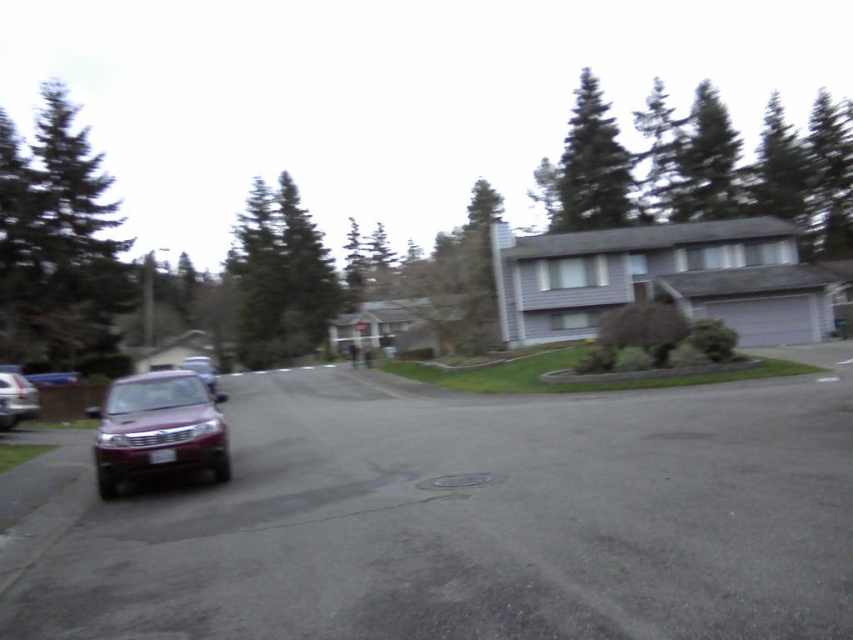
You are a delivery person trying to navigate through the suburban street scene. You need to determine if the green textured tree at upper center will block your path more than the green textured pine tree at upper center. Which tree should you be more concerned about?

The green textured pine tree at upper center is larger than the green textured tree at upper center, so you should be more concerned about the green textured pine tree at upper center blocking your path.

You are a bird flying over the suburban street scene. You want to land on the closest tree to the manhole cover. Which tree should you choose between the green textured tree at upper center and the green textured pine tree at upper center?

The green textured pine tree at upper center is behind the green textured tree at upper center, so the green textured tree at upper center is closer to the manhole cover. Therefore, you should choose the green textured tree at upper center to land on.